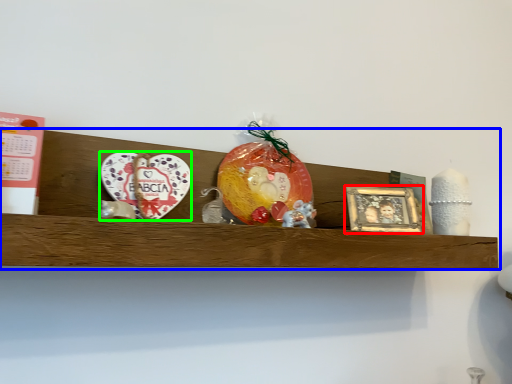
Question: Which object is the closest to the picture frame (highlighted by a red box)? Choose among these: shelf (highlighted by a blue box) or platter (highlighted by a green box).

Choices:
 (A) shelf
 (B) platter

Answer: (A)